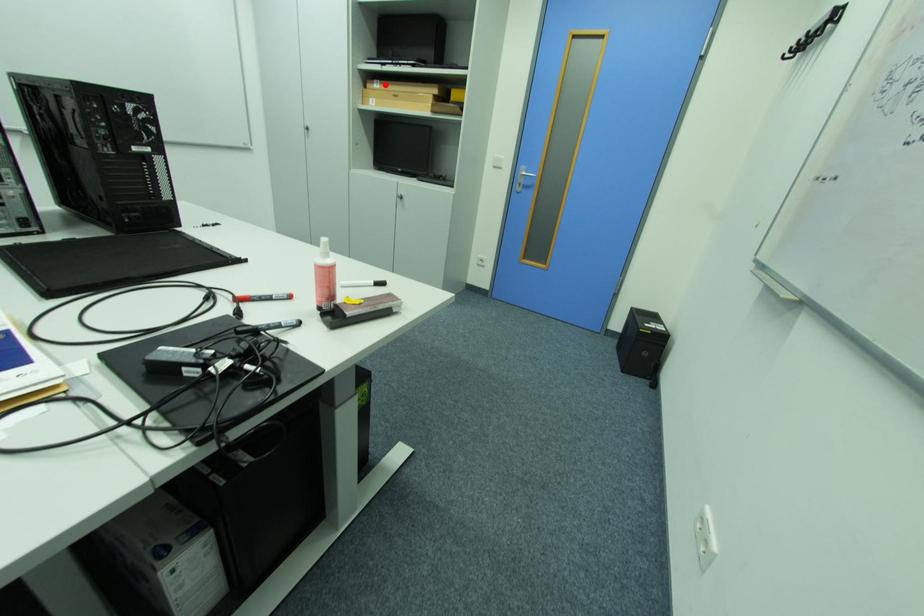
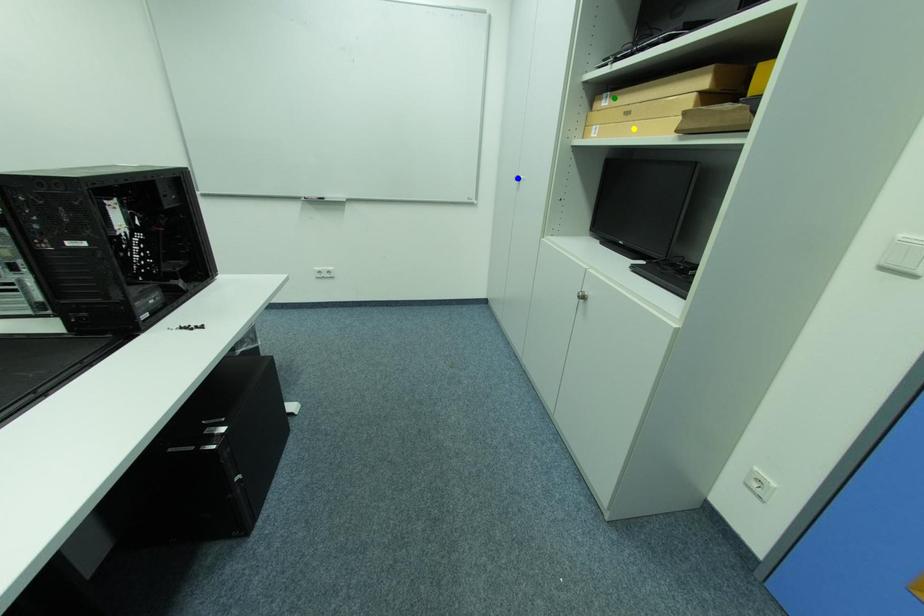
Question: I am providing you with two images of the same scene from different viewpoints. A red point is marked on the first image. You are given multiple points on the second image. Which point in image 2 is actually the same real-world point as the red point in image 1?

Choices:
 (A) yellow point
 (B) blue point
 (C) green point

Answer: (C)